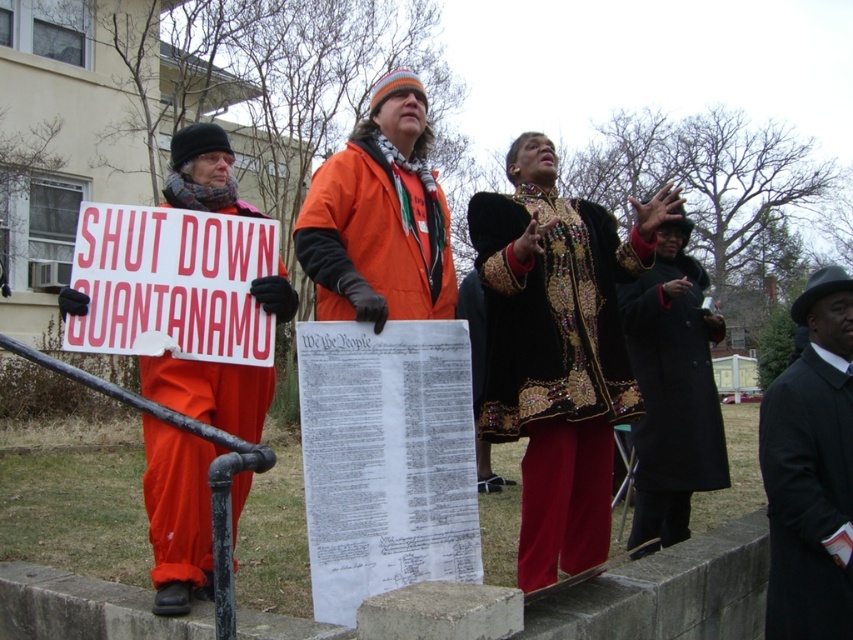
Can you confirm if red plastic sign at center is positioned below black wool coat at right?

Actually, red plastic sign at center is above black wool coat at right.

Where is `red plastic sign at center`? The image size is (853, 640). red plastic sign at center is located at coordinates (172, 284).

You are a GUI agent. You are given a task and a screenshot of the screen. Output one action in this format:
    pyautogui.click(x=<x>, y=<y>)
    Task: Click on the red plastic sign at center
    The width and height of the screenshot is (853, 640).
    Given the screenshot: What is the action you would take?
    pyautogui.click(x=172, y=284)

Is black wool coat at right further to the viewer compared to black fur coat at center?

A: That is False.

Looking at this image, which of these two, black wool coat at right or black fur coat at center, stands taller?

With more height is black fur coat at center.

Locate an element on the screen. The image size is (853, 640). black wool coat at right is located at coordinates (811, 468).

Is red plastic sign at center smaller than black fur coat at center?

Yes, red plastic sign at center is smaller than black fur coat at center.

Does red plastic sign at center have a greater width compared to black fur coat at center?

In fact, red plastic sign at center might be narrower than black fur coat at center.

At what (x,y) coordinates should I click in order to perform the action: click on red plastic sign at center. Please return your answer as a coordinate pair (x, y). Image resolution: width=853 pixels, height=640 pixels. Looking at the image, I should click on (172, 284).